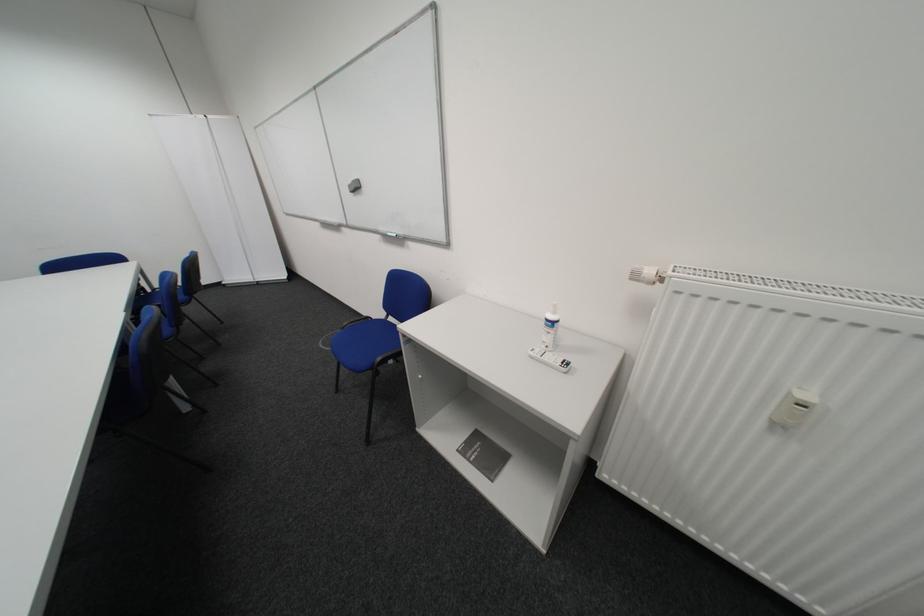
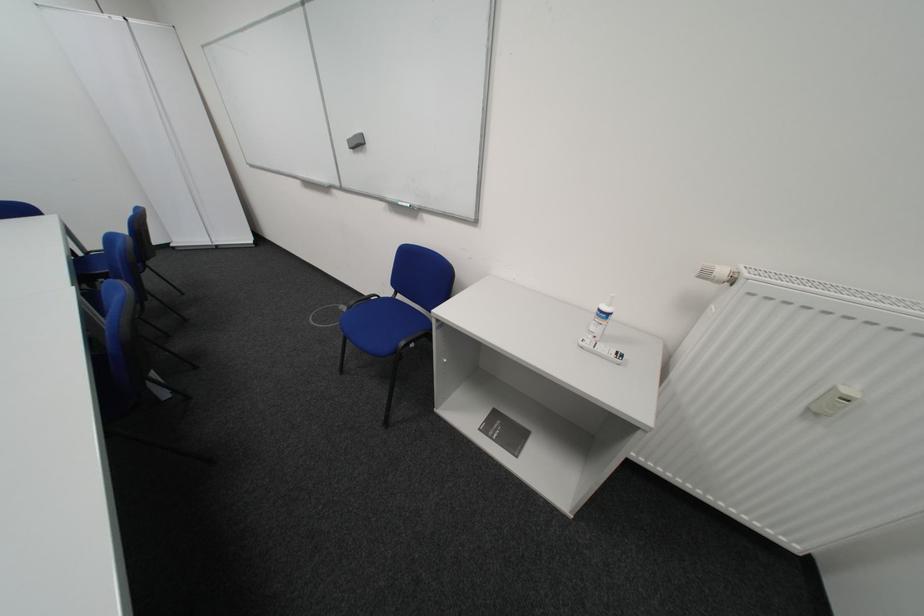
The point at (548, 354) is marked in the first image. Where is the corresponding point in the second image?

(599, 345)